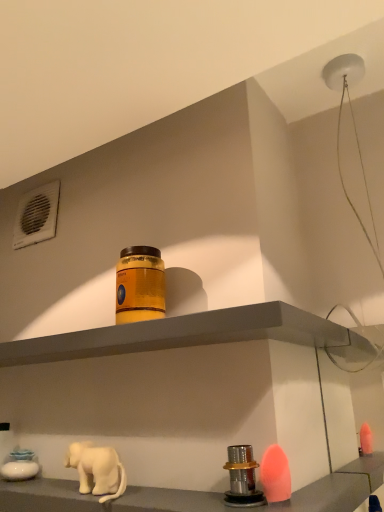
Question: From the image's perspective, is metallic silver knob at lower center, which appears as the first shelf when ordered from the bottom, over white matte elephant at lower left?

Choices:
 (A) yes
 (B) no

Answer: (B)

Question: Can we say metallic silver knob at lower center, marked as the 2th shelf in a top-to-bottom arrangement, lies outside white matte elephant at lower left?

Choices:
 (A) no
 (B) yes

Answer: (B)

Question: Considering the relative positions of metallic silver knob at lower center, marked as the 2th shelf in a top-to-bottom arrangement, and white matte elephant at lower left in the image provided, is metallic silver knob at lower center, marked as the 2th shelf in a top-to-bottom arrangement, to the right of white matte elephant at lower left from the viewer's perspective?

Choices:
 (A) no
 (B) yes

Answer: (A)

Question: Is metallic silver knob at lower center, which appears as the first shelf when ordered from the bottom, taller than white matte elephant at lower left?

Choices:
 (A) yes
 (B) no

Answer: (B)

Question: Is metallic silver knob at lower center, which appears as the first shelf when ordered from the bottom, at the left side of white matte elephant at lower left?

Choices:
 (A) no
 (B) yes

Answer: (B)

Question: Does point (365, 476) appear closer or farther from the camera than point (137, 267)?

Choices:
 (A) closer
 (B) farther

Answer: (A)

Question: Relative to orange matte jar at center, is metallic silver knob at lower center, which appears as the first shelf when ordered from the bottom, in front or behind?

Choices:
 (A) behind
 (B) front

Answer: (B)

Question: From the image's perspective, is metallic silver knob at lower center, marked as the 2th shelf in a top-to-bottom arrangement, positioned above or below orange matte jar at center?

Choices:
 (A) above
 (B) below

Answer: (B)

Question: Do you think metallic silver knob at lower center, marked as the 2th shelf in a top-to-bottom arrangement, is within orange matte jar at center, or outside of it?

Choices:
 (A) inside
 (B) outside

Answer: (B)

Question: Considering the relative positions of orange matte jar at center and metallic silver knob at lower center, marked as the 2th shelf in a top-to-bottom arrangement, in the image provided, is orange matte jar at center to the left or to the right of metallic silver knob at lower center, marked as the 2th shelf in a top-to-bottom arrangement,?

Choices:
 (A) right
 (B) left

Answer: (A)

Question: Considering their positions, is orange matte jar at center located in front of or behind metallic silver knob at lower center, which appears as the first shelf when ordered from the bottom?

Choices:
 (A) behind
 (B) front

Answer: (A)

Question: Considering the positions of point (148, 258) and point (144, 497), is point (148, 258) closer or farther from the camera than point (144, 497)?

Choices:
 (A) closer
 (B) farther

Answer: (B)

Question: From the image's perspective, is orange matte jar at center located above or below metallic silver knob at lower center, marked as the 2th shelf in a top-to-bottom arrangement?

Choices:
 (A) below
 (B) above

Answer: (B)

Question: Is point (67, 457) positioned closer to the camera than point (327, 330)?

Choices:
 (A) farther
 (B) closer

Answer: (A)

Question: From the image's perspective, is white matte elephant at lower left located above or below matte gray shelf at center, acting as the second shelf starting from the bottom?

Choices:
 (A) below
 (B) above

Answer: (A)